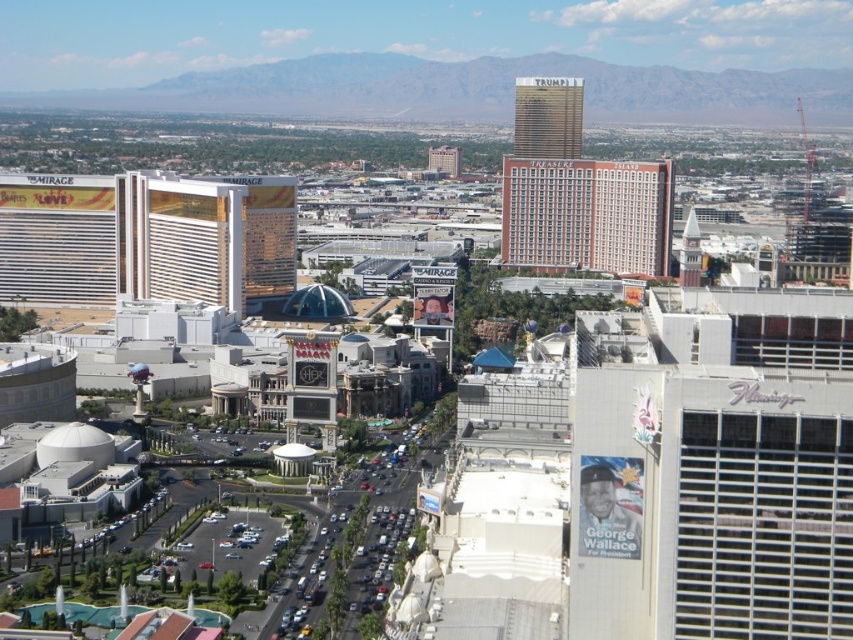
Question: In this image, where is gold reflective hotel at left located relative to beige brick building at center?

Choices:
 (A) below
 (B) above

Answer: (A)

Question: Which point is farther from the camera taking this photo?

Choices:
 (A) (140, 284)
 (B) (647, 244)
 (C) (683, 444)

Answer: (B)

Question: Which object appears closest to the camera in this image?

Choices:
 (A) beige brick building at center
 (B) gold reflective hotel at left

Answer: (B)

Question: Considering the relative positions of white metal flamingo at upper center and gold reflective hotel at left in the image provided, where is white metal flamingo at upper center located with respect to gold reflective hotel at left?

Choices:
 (A) left
 (B) right

Answer: (B)

Question: Does white metal flamingo at upper center lie in front of gold reflective hotel at left?

Choices:
 (A) no
 (B) yes

Answer: (B)

Question: Which object is closer to the camera taking this photo?

Choices:
 (A) beige brick building at center
 (B) white metal flamingo at upper center

Answer: (B)